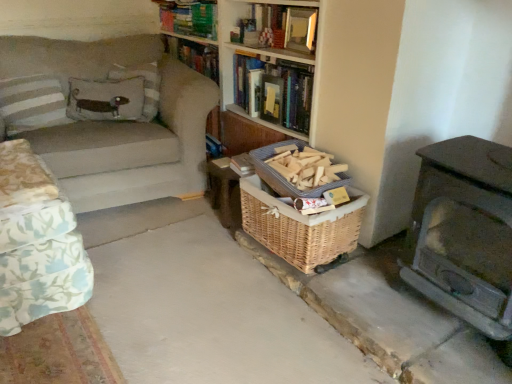
Describe the element at coordinates (37, 243) in the screenshot. The width and height of the screenshot is (512, 384). I see `floral fabric couch at left, the first studio couch viewed from the front` at that location.

Where is `floral fabric couch at left, the first studio couch viewed from the front`? The height and width of the screenshot is (384, 512). floral fabric couch at left, the first studio couch viewed from the front is located at coordinates (37, 243).

Where is `striped fabric pillow at left, arranged as the first pillow when viewed from the left`? The height and width of the screenshot is (384, 512). striped fabric pillow at left, arranged as the first pillow when viewed from the left is located at coordinates (33, 103).

Measure the distance between point (246, 282) and camera.

The distance of point (246, 282) from camera is 1.85 meters.

Where is `woven wood basket at lower center, which ranks as the 1th basket in bottom-to-top order`? The image size is (512, 384). woven wood basket at lower center, which ranks as the 1th basket in bottom-to-top order is located at coordinates (300, 226).

At what (x,y) coordinates should I click in order to perform the action: click on woven brown basket at center, arranged as the 1th basket when viewed from the top. Please return your answer as a coordinate pair (x, y). This screenshot has height=384, width=512. Looking at the image, I should click on (282, 176).

Where is `brown fabric pillow at upper left, the second pillow when ordered from right to left`? Image resolution: width=512 pixels, height=384 pixels. brown fabric pillow at upper left, the second pillow when ordered from right to left is located at coordinates (106, 99).

Locate an element on the screen. This screenshot has width=512, height=384. floral fabric couch at left, positioned as the 2th studio couch in back-to-front order is located at coordinates (37, 243).

Which object is thinner, brown fabric pillow at upper left, the 2th pillow positioned from the left, or hardcover book at upper center, the 1th book positioned from the bottom?

Thinner between the two is brown fabric pillow at upper left, the 2th pillow positioned from the left.

Considering the sizes of objects brown fabric pillow at upper left, the 2th pillow positioned from the left, and hardcover book at upper center, arranged as the third book when viewed from the top, in the image provided, who is bigger, brown fabric pillow at upper left, the 2th pillow positioned from the left, or hardcover book at upper center, arranged as the third book when viewed from the top,?

With larger size is hardcover book at upper center, arranged as the third book when viewed from the top.

Considering the sizes of brown fabric pillow at upper left, the 2th pillow positioned from the left, and hardcover book at upper center, the 1th book positioned from the bottom, in the image, is brown fabric pillow at upper left, the 2th pillow positioned from the left, taller or shorter than hardcover book at upper center, the 1th book positioned from the bottom,?

In the image, brown fabric pillow at upper left, the 2th pillow positioned from the left, appears to be shorter than hardcover book at upper center, the 1th book positioned from the bottom.

Which is closer to the camera, (95, 82) or (261, 306)?

Clearly, point (95, 82) is more distant from the camera than point (261, 306).

Is brown fabric pillow at upper left, the second pillow when ordered from right to left, oriented away from brown textured basket at lower right?

No, brown fabric pillow at upper left, the second pillow when ordered from right to left, is not facing the opposite direction of brown textured basket at lower right.

Considering the sizes of brown fabric pillow at upper left, the second pillow when ordered from right to left, and brown textured basket at lower right in the image, is brown fabric pillow at upper left, the second pillow when ordered from right to left, taller or shorter than brown textured basket at lower right?

Clearly, brown fabric pillow at upper left, the second pillow when ordered from right to left, is taller compared to brown textured basket at lower right.

Based on the photo, how many degrees apart are the facing directions of brown fabric pillow at upper left, the 2th pillow positioned from the left, and brown textured basket at lower right?

51.6 degrees.

From their relative heights in the image, would you say woven wood table at center is taller or shorter than hardcover books at upper center, which is counted as the 1th book, starting from the top?

Considering their sizes, woven wood table at center has more height than hardcover books at upper center, which is counted as the 1th book, starting from the top.

Does woven wood table at center have a greater width compared to hardcover books at upper center, which is counted as the 1th book, starting from the top?

Yes.

Could you tell me if woven wood table at center is turned towards hardcover books at upper center, which is counted as the 1th book, starting from the top?

No, woven wood table at center does not turn towards hardcover books at upper center, which is counted as the 1th book, starting from the top.

Does woven brown basket at center, arranged as the 1th basket when viewed from the top, have a greater height compared to hardcover book at upper center, the 2th book in the bottom-to-top sequence?

In fact, woven brown basket at center, arranged as the 1th basket when viewed from the top, may be shorter than hardcover book at upper center, the 2th book in the bottom-to-top sequence.

From the image's perspective, does woven brown basket at center, arranged as the 1th basket when viewed from the top, appear higher than hardcover book at upper center, which is the 2th book in top-to-bottom order?

Incorrect, from the image's perspective, woven brown basket at center, arranged as the 1th basket when viewed from the top, is lower than hardcover book at upper center, which is the 2th book in top-to-bottom order.

Considering the positions of objects woven brown basket at center, the second basket positioned from the bottom, and hardcover book at upper center, which is the 2th book in top-to-bottom order, in the image provided, who is in front, woven brown basket at center, the second basket positioned from the bottom, or hardcover book at upper center, which is the 2th book in top-to-bottom order,?

woven brown basket at center, the second basket positioned from the bottom, is in front.

Which is more to the right, woven brown basket at center, arranged as the 1th basket when viewed from the top, or hardcover book at upper center, which is the 2th book in top-to-bottom order?

From the viewer's perspective, woven brown basket at center, arranged as the 1th basket when viewed from the top, appears more on the right side.

Which of these two, yellow paper at upper center or brown textured basket at lower right, stands shorter?

Standing shorter between the two is brown textured basket at lower right.

Is yellow paper at upper center situated inside brown textured basket at lower right or outside?

yellow paper at upper center is outside brown textured basket at lower right.

Could you tell me if yellow paper at upper center is turned towards brown textured basket at lower right?

No, yellow paper at upper center is not turned towards brown textured basket at lower right.

Considering the relative positions of yellow paper at upper center and brown textured basket at lower right in the image provided, is yellow paper at upper center to the left of brown textured basket at lower right from the viewer's perspective?

No.

Considering the relative sizes of brown textured basket at lower right and hardcover book at upper center, arranged as the third book when viewed from the top, in the image provided, is brown textured basket at lower right smaller than hardcover book at upper center, arranged as the third book when viewed from the top,?

Actually, brown textured basket at lower right might be larger than hardcover book at upper center, arranged as the third book when viewed from the top.

Does brown textured basket at lower right appear on the left side of hardcover book at upper center, the 1th book positioned from the bottom?

Correct, you'll find brown textured basket at lower right to the left of hardcover book at upper center, the 1th book positioned from the bottom.

Considering the sizes of objects brown textured basket at lower right and hardcover book at upper center, the 1th book positioned from the bottom, in the image provided, who is wider, brown textured basket at lower right or hardcover book at upper center, the 1th book positioned from the bottom,?

Wider between the two is brown textured basket at lower right.

Does hardcover book at upper center, arranged as the third book when viewed from the top, have a greater height compared to yellow paper at upper center?

Yes.

Looking at this image, from a real-world perspective, is hardcover book at upper center, arranged as the third book when viewed from the top, located higher than yellow paper at upper center?

Yes, from a real-world perspective, hardcover book at upper center, arranged as the third book when viewed from the top, is on top of yellow paper at upper center.

Is hardcover book at upper center, the 1th book positioned from the bottom, bigger or smaller than yellow paper at upper center?

Considering their sizes, hardcover book at upper center, the 1th book positioned from the bottom, takes up more space than yellow paper at upper center.

Does hardcover book at upper center, arranged as the third book when viewed from the top, lie behind yellow paper at upper center?

No, hardcover book at upper center, arranged as the third book when viewed from the top, is closer to the camera.

The image size is (512, 384). Identify the location of the 2nd pillow counting from the left of the hardcover book at upper center, arranged as the third book when viewed from the top. (106, 99).

In order to click on concrete on the right of the brown fabric pillow at upper left, the 2th pillow positioned from the left in this screenshot , I will do pyautogui.click(x=204, y=305).

When comparing their distances from woven brown basket at center, the second basket positioned from the bottom, does brown fabric pillow at upper left, the second pillow when ordered from right to left, or beige fabric couch at left, placed as the second studio couch when sorted from front to back, seem closer?

Based on the image, beige fabric couch at left, placed as the second studio couch when sorted from front to back, appears to be nearer to woven brown basket at center, the second basket positioned from the bottom.

Considering their positions, is hardcover books at upper center, which is counted as the 1th book, starting from the top, positioned further to brown textured basket at lower right than beige fabric couch at left, placed as the second studio couch when sorted from front to back?

Among the two, hardcover books at upper center, which is counted as the 1th book, starting from the top, is located further to brown textured basket at lower right.

Estimate the real-world distances between objects in this image. Which object is further from hardcover book at upper center, arranged as the third book when viewed from the top, beige fabric couch at left, marked as the first studio couch in a back-to-front arrangement, or woven brown basket at center, arranged as the 1th basket when viewed from the top?

beige fabric couch at left, marked as the first studio couch in a back-to-front arrangement, is further to hardcover book at upper center, arranged as the third book when viewed from the top.

Looking at this image, considering their positions, is velvet-like brown pillow at upper left, the 1th pillow in the right-to-left sequence, positioned further to hardcover book at upper center, the 2th book in the bottom-to-top sequence, than beige fabric couch at left, placed as the second studio couch when sorted from front to back?

beige fabric couch at left, placed as the second studio couch when sorted from front to back, lies further to hardcover book at upper center, the 2th book in the bottom-to-top sequence, than the other object.

Looking at the image, which one is located closer to hardcover book at upper center, the 1th book positioned from the bottom, hardcover books at upper center, which is counted as the 1th book, starting from the top, or woven brown basket at center, the second basket positioned from the bottom?

Based on the image, woven brown basket at center, the second basket positioned from the bottom, appears to be nearer to hardcover book at upper center, the 1th book positioned from the bottom.

From the picture: Estimate the real-world distances between objects in this image. Which object is further from brown textured basket at lower right, woven wood basket at lower center, which ranks as the 1th basket in bottom-to-top order, or hardcover book at upper center, arranged as the third book when viewed from the top?

hardcover book at upper center, arranged as the third book when viewed from the top.

When comparing their distances from floral fabric couch at left, positioned as the 2th studio couch in back-to-front order, does brown textured basket at lower right or striped fabric pillow at left, arranged as the first pillow when viewed from the left, seem further?

The object further to floral fabric couch at left, positioned as the 2th studio couch in back-to-front order, is striped fabric pillow at left, arranged as the first pillow when viewed from the left.

When comparing their distances from hardcover book at upper center, the 1th book positioned from the bottom, does hardcover books at upper center, which is counted as the 1th book, starting from the top, or hardcover book at upper center, the 2th book in the bottom-to-top sequence, seem further?

The object further to hardcover book at upper center, the 1th book positioned from the bottom, is hardcover books at upper center, which is counted as the 1th book, starting from the top.

Locate an element on the screen. The image size is (512, 384). table positioned between brown textured basket at lower right and velvet-like brown pillow at upper left, placed as the third pillow when sorted from left to right, from near to far is located at coordinates (228, 181).

This screenshot has width=512, height=384. What are the coordinates of `studio couch between hardcover books at upper center, which is counted as the 1th book, starting from the top, and woven wood basket at lower center, marked as the second basket in a top-to-bottom arrangement, from top to bottom` in the screenshot? It's located at (106, 117).

The width and height of the screenshot is (512, 384). I want to click on paperback book between brown fabric pillow at upper left, the 2th pillow positioned from the left, and woven brown basket at center, the second basket positioned from the bottom, from left to right, so click(x=271, y=98).

What are the coordinates of `book between hardcover book at upper center, which is the 2th book in top-to-bottom order, and yellow paper at upper center, in the vertical direction` in the screenshot? It's located at (274, 90).